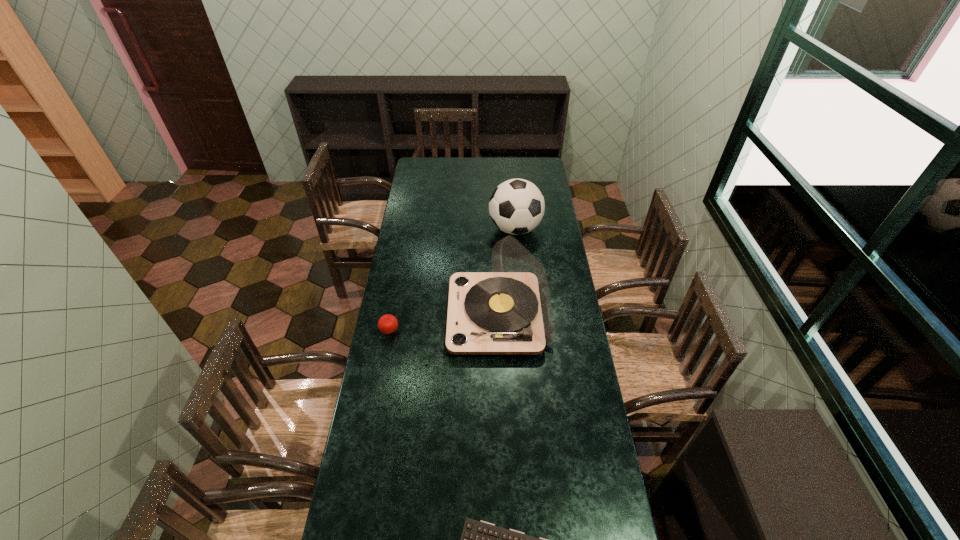
The image size is (960, 540). What are the coordinates of `object situated at the left edge` in the screenshot? It's located at (387, 324).

Image resolution: width=960 pixels, height=540 pixels. I want to click on record player located at the right edge, so click(x=508, y=311).

At what (x,y) coordinates should I click in order to perform the action: click on soccer ball that is at the right edge. Please return your answer as a coordinate pair (x, y). Looking at the image, I should click on (516, 206).

Identify the location of free region at the far edge of the desktop. This screenshot has width=960, height=540. (470, 168).

In the image, there is a desktop. Where is `vacant space at the left edge`? vacant space at the left edge is located at coordinates (423, 192).

You are a GUI agent. You are given a task and a screenshot of the screen. Output one action in this format:
    pyautogui.click(x=<x>, y=<y>)
    Task: Click on the vacant space at the right edge of the desktop
    The image size is (960, 540).
    Given the screenshot: What is the action you would take?
    pyautogui.click(x=554, y=218)

Find the location of a particular element. free spot at the far left corner of the desktop is located at coordinates (422, 173).

Select which object is the closest to the computer keyboard. Please provide its 2D coordinates. Your answer should be formatted as a tuple, i.e. [(x, y)], where the tuple contains the x and y coordinates of a point satisfying the conditions above.

[(508, 311)]

You are a GUI agent. You are given a task and a screenshot of the screen. Output one action in this format:
    pyautogui.click(x=<x>, y=<y>)
    Task: Click on the third closest object relative to the farthest object
    This screenshot has height=540, width=960.
    Given the screenshot: What is the action you would take?
    pyautogui.click(x=479, y=539)